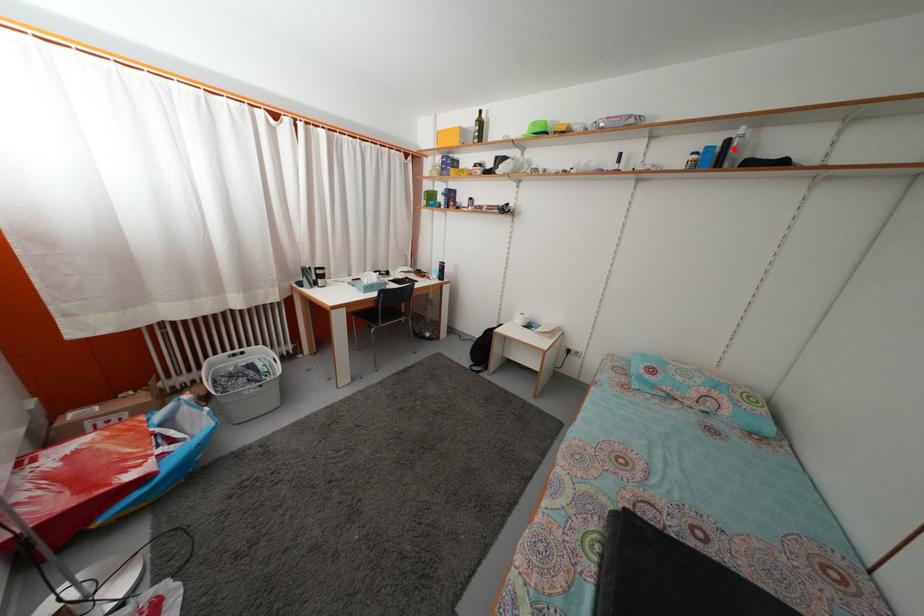
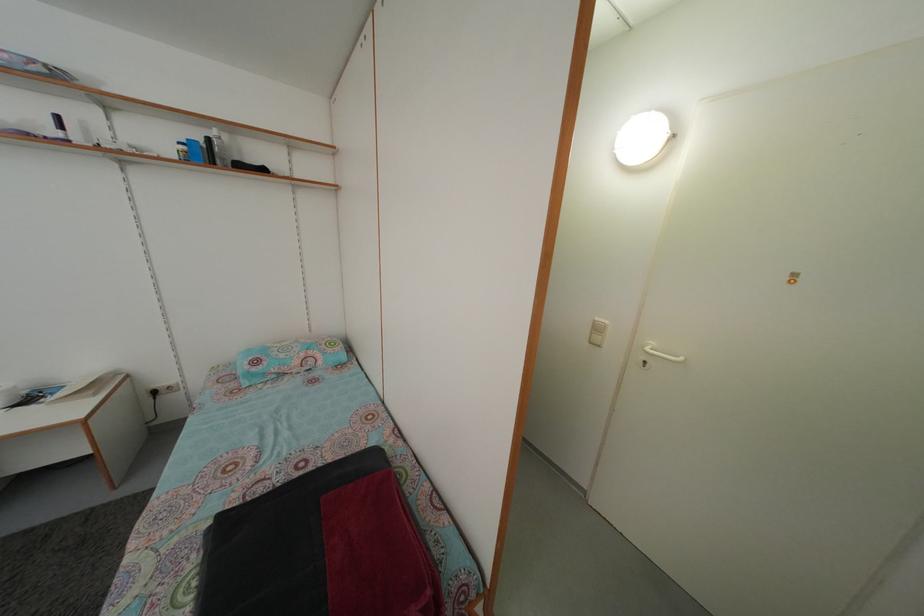
Where in the second image is the point corresponding to the highlighted location from the first image?

(214, 148)